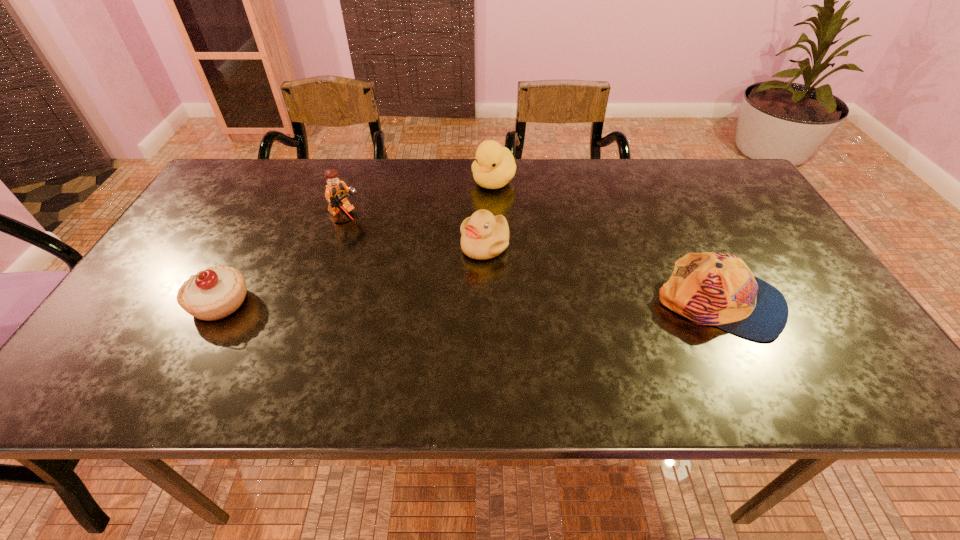
The image size is (960, 540). Find the location of `free spot on the desktop that is between the pastry and the rightmost object and is positioned on the front-facing side of the duck`. free spot on the desktop that is between the pastry and the rightmost object and is positioned on the front-facing side of the duck is located at coordinates (409, 303).

Find the location of a particular element. The image size is (960, 540). free spot on the desktop that is between the pastry and the rightmost object and is positioned on the beak of the duckling is located at coordinates (460, 303).

This screenshot has width=960, height=540. In order to click on free space on the desktop that is between the leftmost object and the cap and is positioned holding a crossbow in the hands of the Lego in this screenshot , I will do click(x=512, y=303).